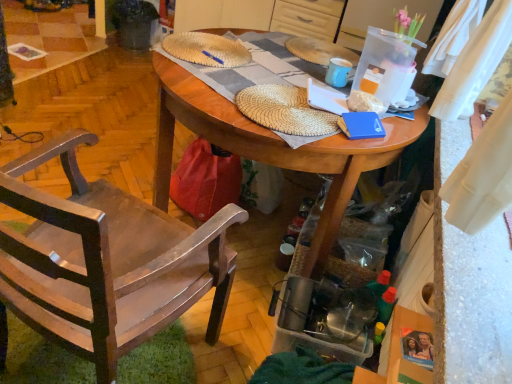
Image resolution: width=512 pixels, height=384 pixels. Identify the location of empty space that is in between matte blue mug at upper center and blue plastic pen at center. (269, 66).